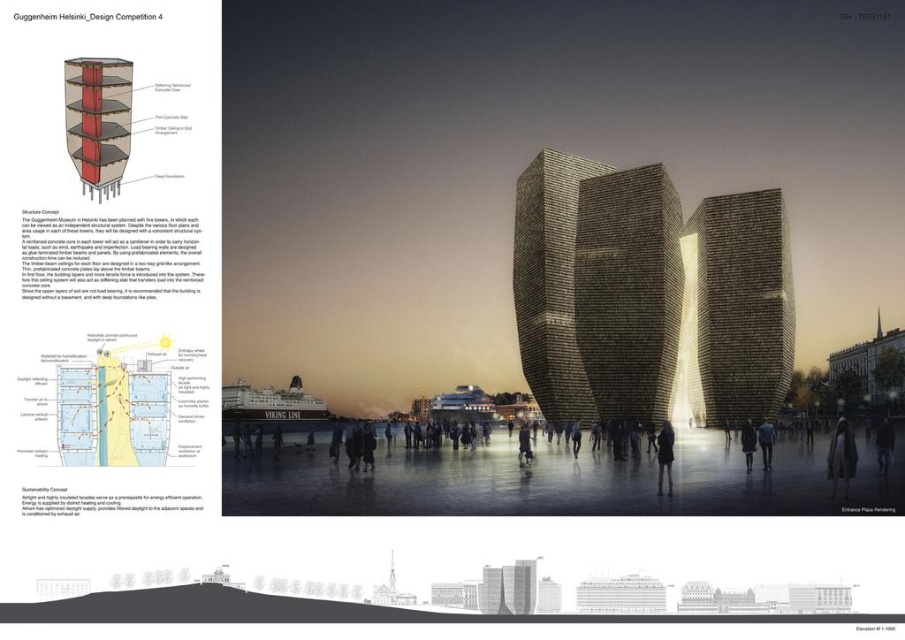
Image resolution: width=905 pixels, height=640 pixels. In order to click on dark gray stone tower at center in this screenshot , I will do `click(627, 291)`.

The height and width of the screenshot is (640, 905). Describe the element at coordinates (627, 291) in the screenshot. I see `dark gray stone tower at center` at that location.

Image resolution: width=905 pixels, height=640 pixels. Find the location of `dark gray stone tower at center`. dark gray stone tower at center is located at coordinates (627, 291).

Between green textured stone tower at center and dark fabric jacket at center, which one has more height?

Standing taller between the two is green textured stone tower at center.

Is point (573, 224) less distant than point (889, 422)?

That is True.

Does point (532, 170) come farther from viewer compared to point (888, 461)?

Yes.

I want to click on green textured stone tower at center, so click(x=550, y=284).

Measure the distance between point (606, 291) and camera.

Point (606, 291) is 103.50 meters away from camera.

Does point (598, 193) lie in front of point (574, 157)?

That is True.

Locate an element on the screen. dark gray stone tower at center is located at coordinates (627, 291).